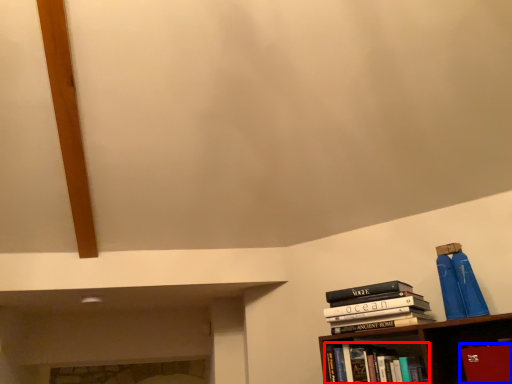
Question: Among these objects, which one is farthest to the camera, book (highlighted by a red box) or paperback book (highlighted by a blue box)?

Choices:
 (A) book
 (B) paperback book

Answer: (A)